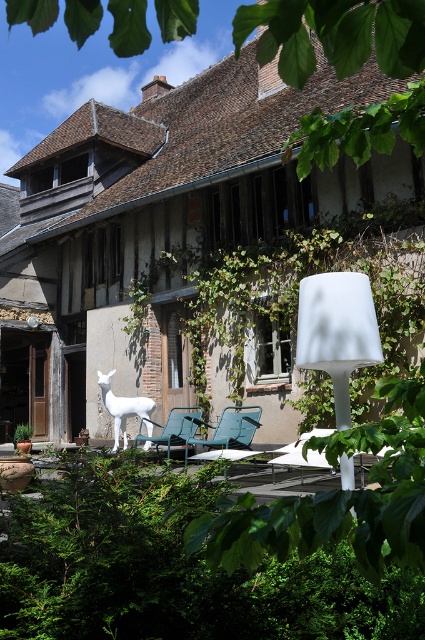
You are standing at the entrance of the rustic building and want to walk towards the white ceramic deer sculpture. There are two points marked on the ground labeled as point (152, 547) and point (147, 403). Which point should you step on first to reach the deer sculpture?

You should step on point (152, 547) first because it is in front of point (147, 403), meaning it is closer to the entrance and the direction of the deer sculpture.

You are standing in front of the rustic building and want to determine the relative positions of two points marked in the scene. Which point, point (363, 289) or point (99, 376), is closer to you?

Point (363, 289) is closer to the viewer than point (99, 376).

You are standing in front of the rustic building and want to place a small potted plant between the two points marked as point [218,422] and point [129,403]. Which point should the plant be closer to in order to be nearer to the viewer?

The plant should be closer to point [218,422] because it is nearer to the viewer compared to point [129,403].